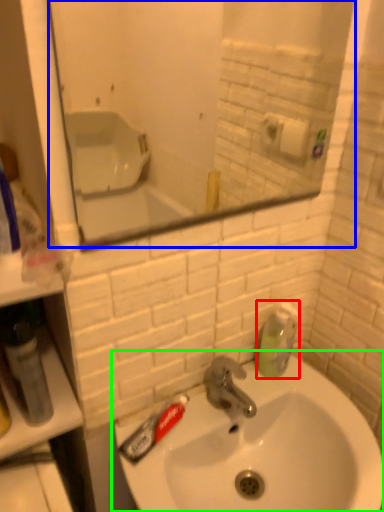
Question: Which object is the closest to the soap dispenser (highlighted by a red box)? Choose among these: mirror (highlighted by a blue box) or sink (highlighted by a green box).

Choices:
 (A) mirror
 (B) sink

Answer: (B)